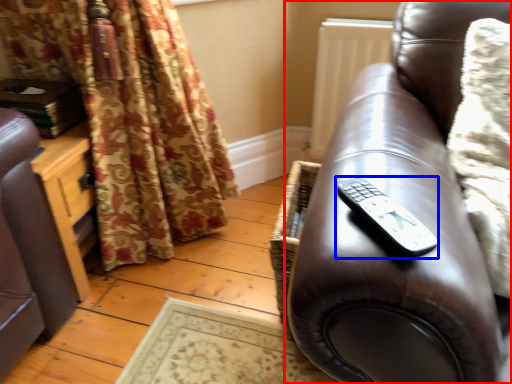
Question: Which point is further to the camera, studio couch (highlighted by a red box) or remote (highlighted by a blue box)?

Choices:
 (A) studio couch
 (B) remote

Answer: (B)